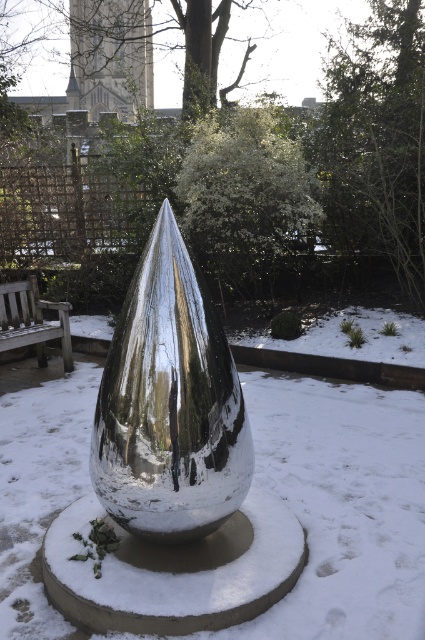
You are an artist planning to paint the snowy garden scene. You want to ensure the green leafy tree at center and the shiny metallic teardrop at center are proportionally accurate. Which object should you draw larger in your painting?

The green leafy tree at center should be drawn larger than the shiny metallic teardrop at center since it is bigger in the scene.